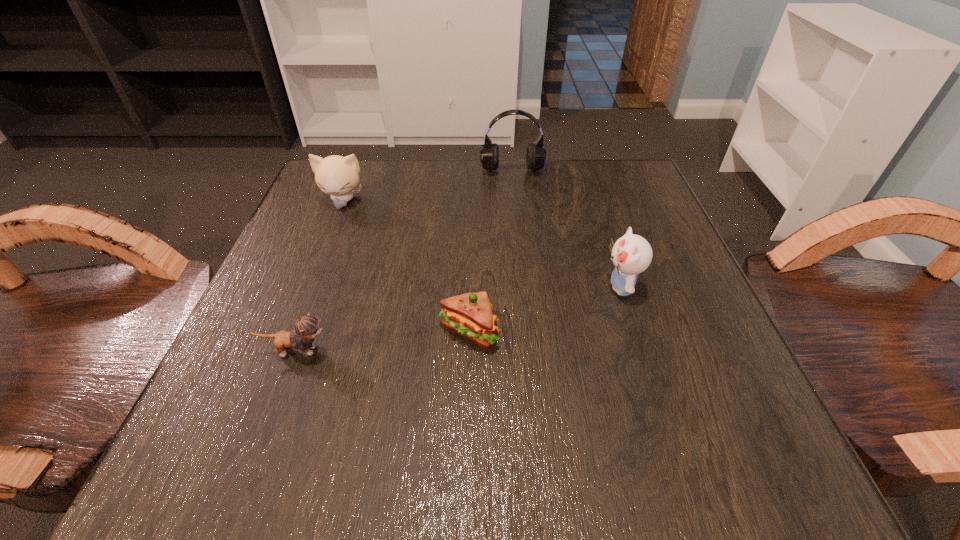
At what (x,y) coordinates should I click in order to perform the action: click on headset. Please return your answer as a coordinate pair (x, y). The height and width of the screenshot is (540, 960). Looking at the image, I should click on (535, 155).

Identify the location of the third farthest object. (632, 254).

Where is `the second farthest kitten`? The image size is (960, 540). the second farthest kitten is located at coordinates (632, 254).

At what (x,y) coordinates should I click in order to perform the action: click on the farthest kitten. Please return your answer as a coordinate pair (x, y). Image resolution: width=960 pixels, height=540 pixels. Looking at the image, I should click on (335, 175).

Image resolution: width=960 pixels, height=540 pixels. I want to click on sandwich, so click(470, 315).

Locate an element on the screen. This screenshot has height=540, width=960. the nearest kitten is located at coordinates (307, 327).

This screenshot has height=540, width=960. What are the coordinates of `vacant region located 0.160m on the ear cushions of the headset` in the screenshot? It's located at (520, 245).

Image resolution: width=960 pixels, height=540 pixels. I want to click on vacant space situated 0.400m on the front-facing side of the rightmost object, so click(367, 287).

Identify the location of vacant space positioned on the front-facing side of the rightmost object. (561, 287).

Identify the location of free spot located 0.280m on the front-facing side of the rightmost object. (437, 287).